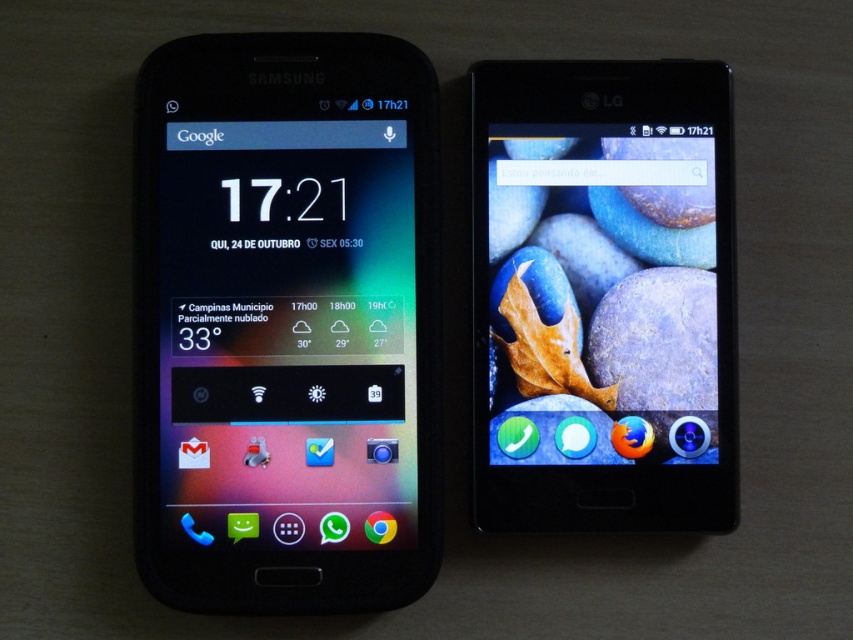
Question: From the image, what is the correct spatial relationship of matte black phone at left in relation to matte black phone at right?

Choices:
 (A) below
 (B) above

Answer: (A)

Question: Which of the following is the closest to the observer?

Choices:
 (A) (532, 129)
 (B) (283, 564)

Answer: (B)

Question: Is the position of matte black phone at left more distant than that of matte black phone at right?

Choices:
 (A) no
 (B) yes

Answer: (A)

Question: Does matte black phone at left appear over matte black phone at right?

Choices:
 (A) no
 (B) yes

Answer: (A)